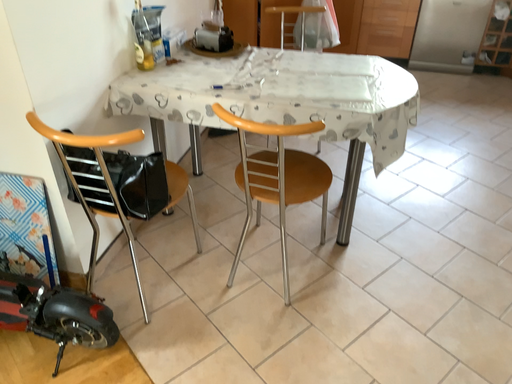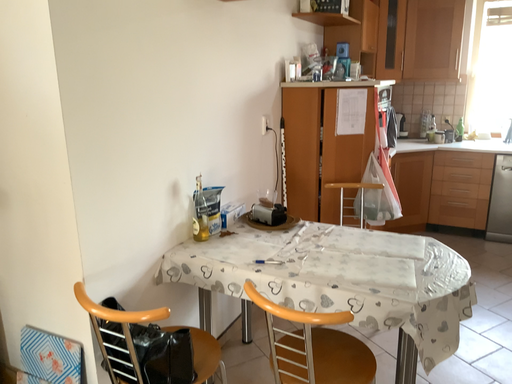
Question: How did the camera likely rotate when shooting the video?

Choices:
 (A) rotated left
 (B) rotated right

Answer: (A)